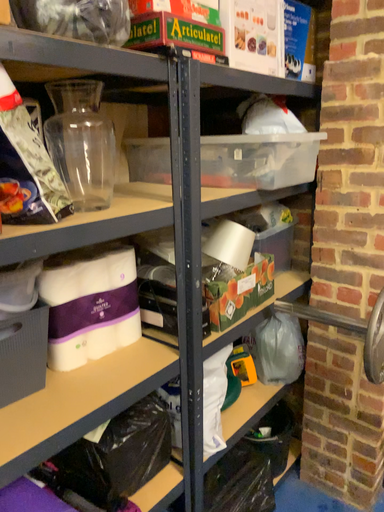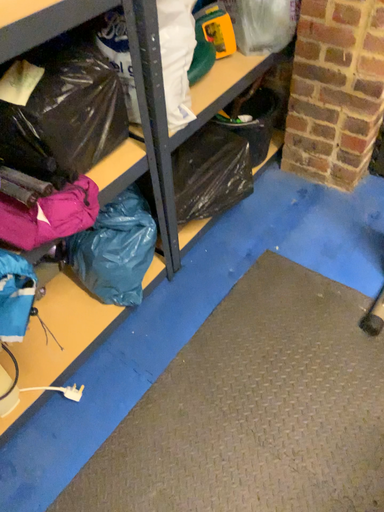
Question: How did the camera likely rotate when shooting the video?

Choices:
 (A) rotated upward
 (B) rotated downward

Answer: (B)